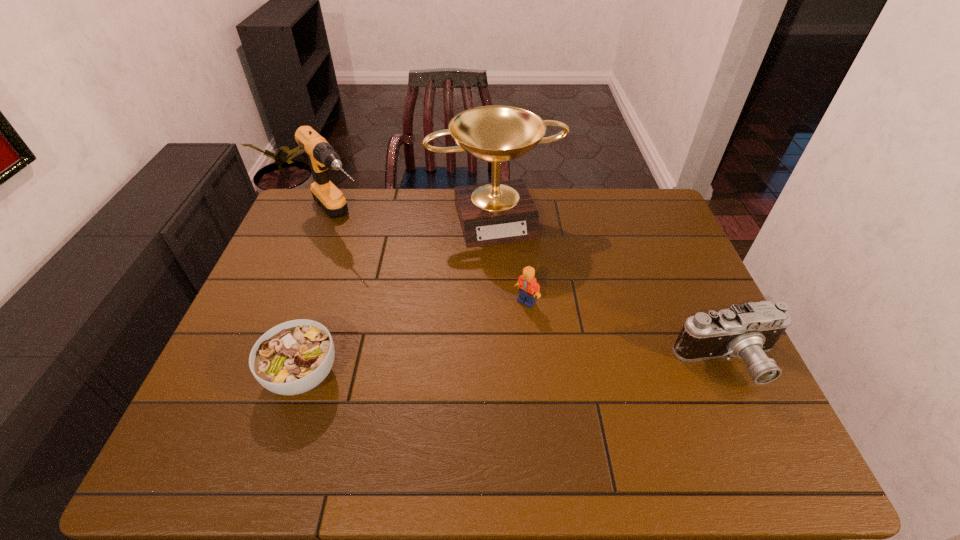
Select which object appears as the third closest to the third farthest object. Please provide its 2D coordinates. Your answer should be formatted as a tuple, i.e. [(x, y)], where the tuple contains the x and y coordinates of a point satisfying the conditions above.

[(293, 357)]

Locate which object is the third closest to the drill. Please provide its 2D coordinates. Your answer should be formatted as a tuple, i.e. [(x, y)], where the tuple contains the x and y coordinates of a point satisfying the conditions above.

[(528, 287)]

Where is `vacant region that satisfies the following two spatial constraints: 1. on the back side of the soup bowl; 2. on the left side of the third nearest object`? This screenshot has width=960, height=540. vacant region that satisfies the following two spatial constraints: 1. on the back side of the soup bowl; 2. on the left side of the third nearest object is located at coordinates (327, 301).

I want to click on free spot that satisfies the following two spatial constraints: 1. on the back side of the award; 2. on the left side of the shortest object, so click(x=355, y=217).